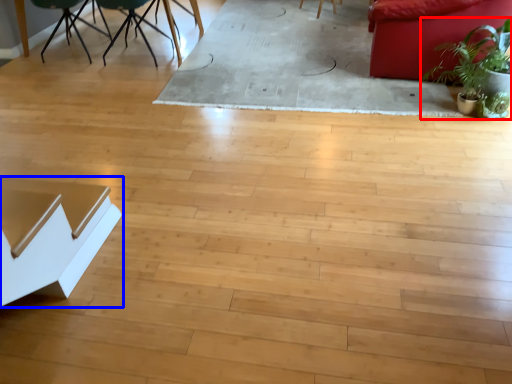
Question: Among these objects, which one is farthest to the camera, houseplant (highlighted by a red box) or table (highlighted by a blue box)?

Choices:
 (A) houseplant
 (B) table

Answer: (A)